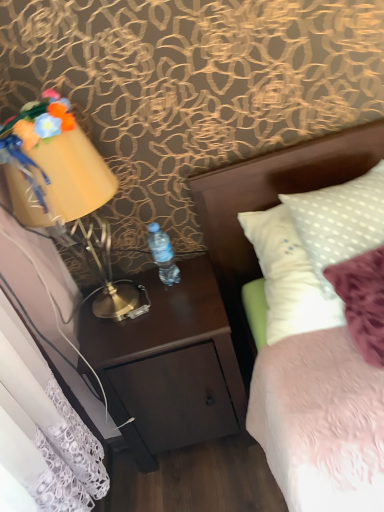
Locate an element on the screen. Image resolution: width=384 pixels, height=512 pixels. vacant area located to the right-hand side of clear plastic bottle at center is located at coordinates (195, 269).